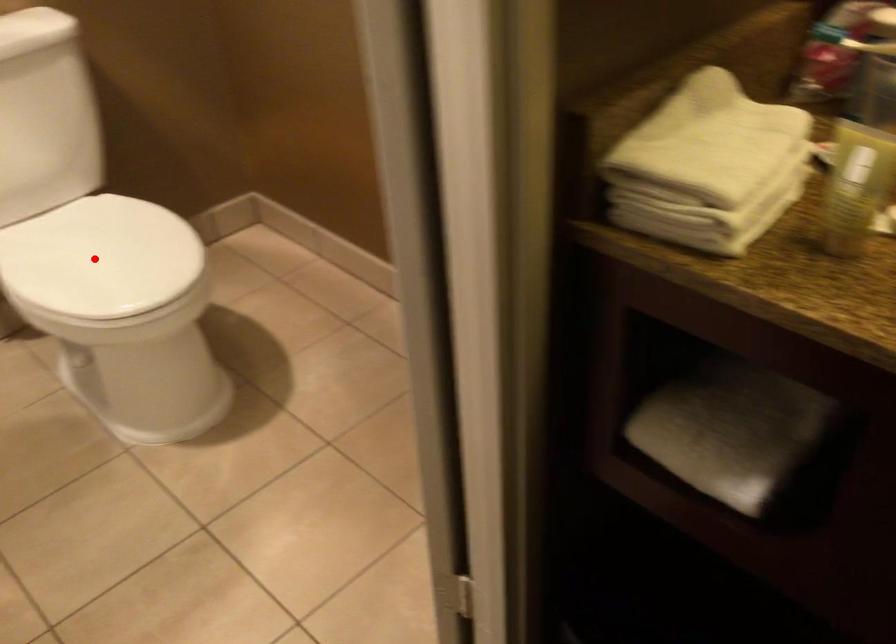
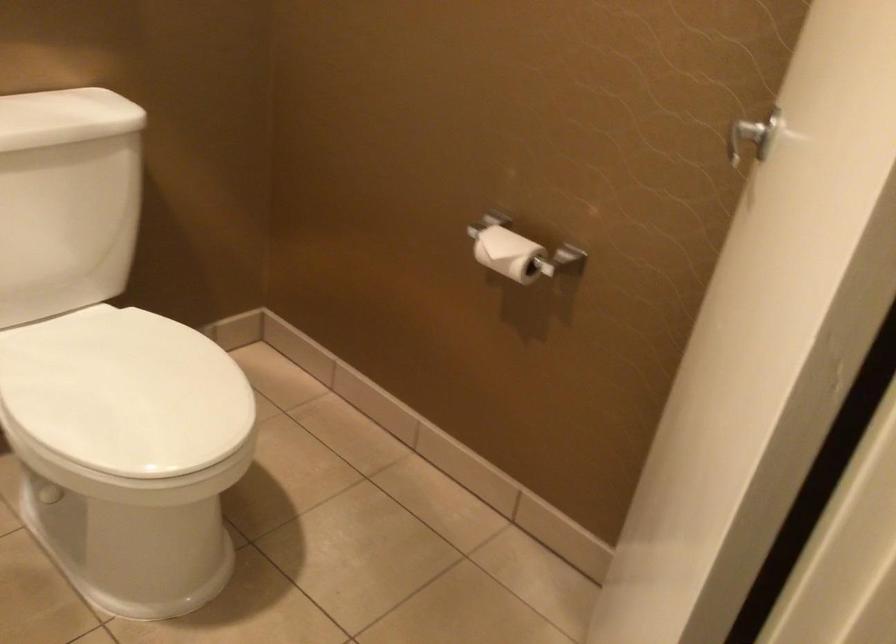
Locate, in the second image, the point that corresponds to the highlighted location in the first image.

(125, 393)